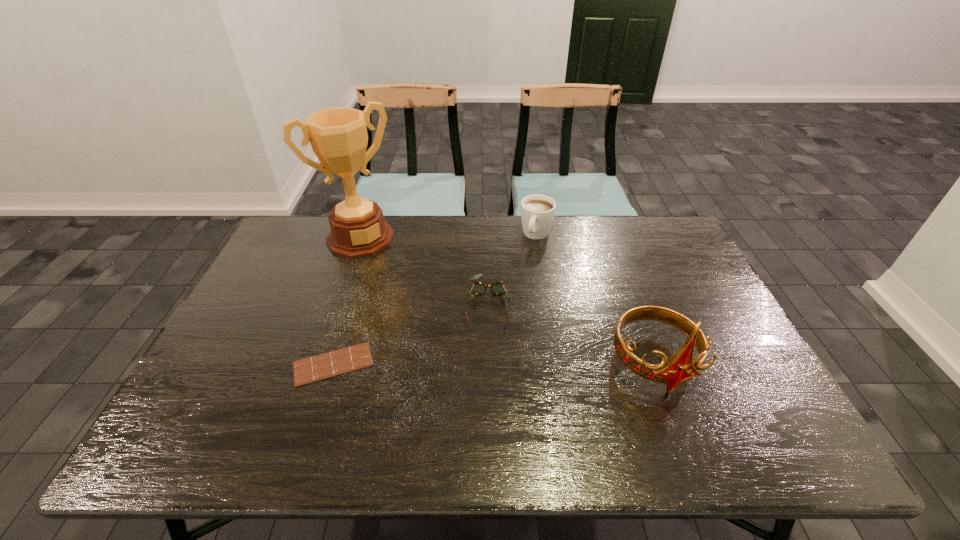
Identify the location of chocolate bar. This screenshot has width=960, height=540. (334, 363).

Locate an element on the screen. The image size is (960, 540). the rightmost object is located at coordinates (680, 368).

This screenshot has height=540, width=960. Find the location of `the fourth shortest object`. the fourth shortest object is located at coordinates [x=680, y=368].

Image resolution: width=960 pixels, height=540 pixels. I want to click on the second object from right to left, so click(537, 211).

Find the location of a particular element. This screenshot has height=540, width=960. cappuccino is located at coordinates (537, 211).

You are a GUI agent. You are given a task and a screenshot of the screen. Output one action in this format:
    pyautogui.click(x=<x>, y=<y>)
    Task: Click on the fourth tallest object
    The height and width of the screenshot is (540, 960).
    Given the screenshot: What is the action you would take?
    click(x=497, y=288)

I want to click on spectacles, so click(497, 288).

The image size is (960, 540). I want to click on the tallest object, so click(338, 136).

The image size is (960, 540). I want to click on vacant space situated on the back of the chocolate bar, so click(x=366, y=259).

Identify the location of vacant area situated 0.280m with the handle on the side of the fourth object from left to right. (507, 302).